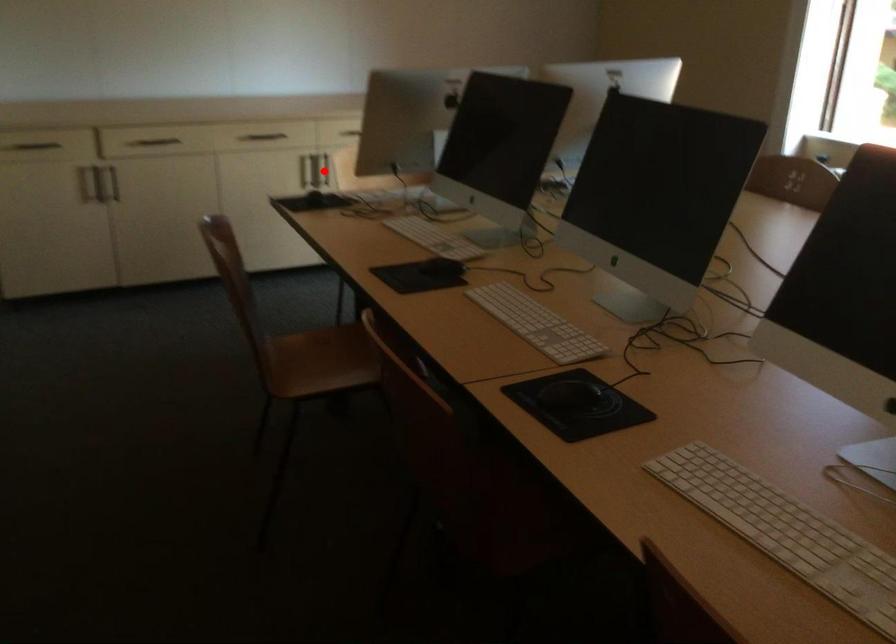
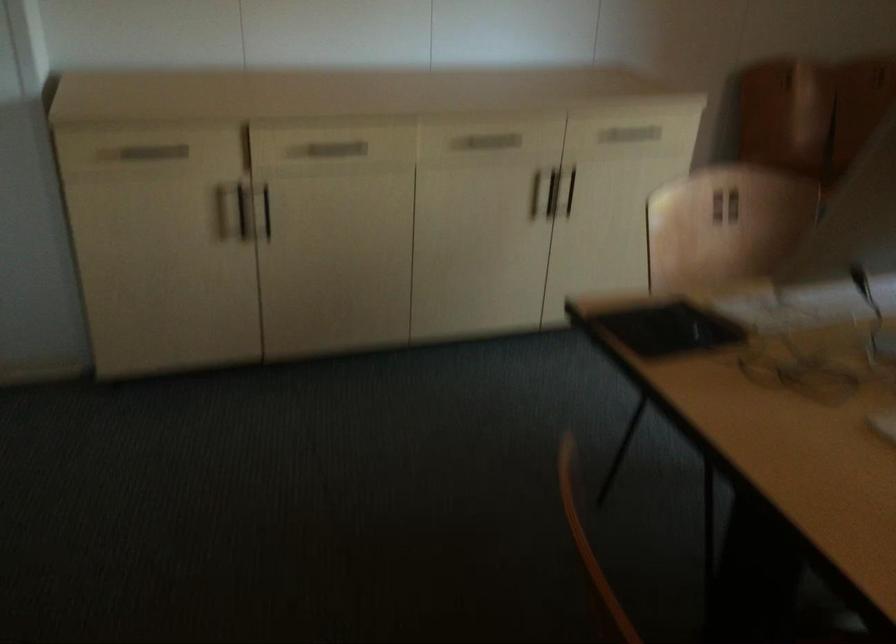
Find the pixel in the second image that matches the highlighted location in the first image.

(570, 192)